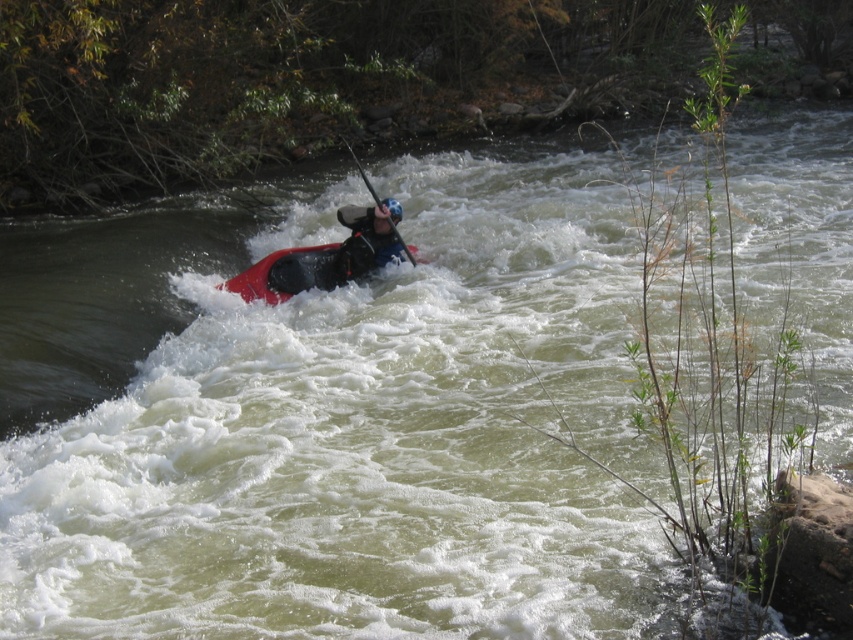
From the picture: How distant is matte black kayak at center from matte red kayak at center?

matte black kayak at center and matte red kayak at center are 13.84 inches apart.

Who is taller, matte black kayak at center or matte red kayak at center?

Standing taller between the two is matte black kayak at center.

Is point (398, 218) positioned after point (276, 253)?

No, (398, 218) is in front of (276, 253).

Where is `matte black kayak at center`? matte black kayak at center is located at coordinates click(x=363, y=243).

Which is more to the right, matte black kayak at center or smooth black paddle at center?

From the viewer's perspective, matte black kayak at center appears more on the right side.

Measure the distance between matte black kayak at center and camera.

35.99 feet

Image resolution: width=853 pixels, height=640 pixels. In order to click on matte black kayak at center in this screenshot , I will do `click(363, 243)`.

Does matte red kayak at center lie in front of smooth black paddle at center?

Yes, it is.

Between point (228, 284) and point (413, 257), which one is positioned in front?

Point (228, 284) is more forward.

Locate an element on the screen. matte red kayak at center is located at coordinates (281, 273).